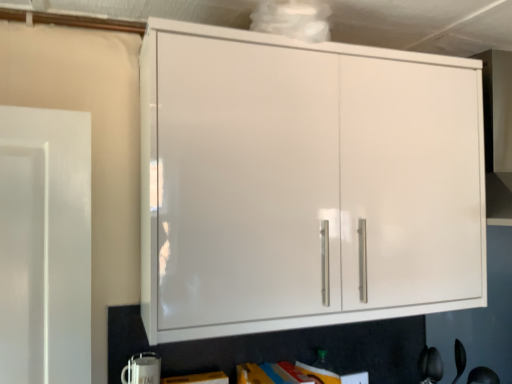
Question: From a real-world perspective, is white glossy mug at lower left physically located above or below white glossy cabinet at upper center?

Choices:
 (A) above
 (B) below

Answer: (B)

Question: In terms of size, does white glossy mug at lower left appear bigger or smaller than white glossy cabinet at upper center?

Choices:
 (A) small
 (B) big

Answer: (A)

Question: Based on their positions, is white glossy mug at lower left located to the left or right of white glossy cabinet at upper center?

Choices:
 (A) right
 (B) left

Answer: (B)

Question: Visually, is white glossy cabinet at upper center positioned to the left or to the right of white glossy mug at lower left?

Choices:
 (A) right
 (B) left

Answer: (A)

Question: Is white glossy cabinet at upper center inside or outside of white glossy mug at lower left?

Choices:
 (A) inside
 (B) outside

Answer: (B)

Question: Looking at the image, does white glossy cabinet at upper center seem bigger or smaller compared to white glossy mug at lower left?

Choices:
 (A) small
 (B) big

Answer: (B)

Question: Does point (285, 246) appear closer or farther from the camera than point (132, 382)?

Choices:
 (A) farther
 (B) closer

Answer: (B)